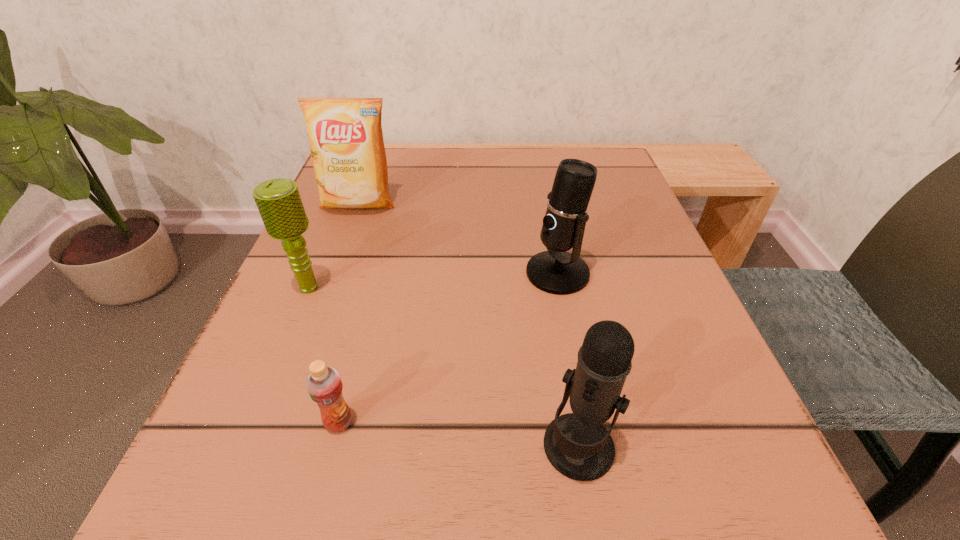
The height and width of the screenshot is (540, 960). I want to click on crisp (potato chip) that is at the left edge, so click(x=345, y=134).

Find the location of a particular element. microphone that is positioned at the left edge is located at coordinates (279, 202).

I want to click on orange juice positioned at the left edge, so click(324, 385).

Find the location of a particular element. The image size is (960, 540). object present at the far left corner is located at coordinates (345, 134).

This screenshot has width=960, height=540. In order to click on object at the near right corner in this screenshot , I will do `click(577, 445)`.

You are a GUI agent. You are given a task and a screenshot of the screen. Output one action in this format:
    pyautogui.click(x=<x>, y=<y>)
    Task: Click on the blank space at the far edge of the desktop
    
    Given the screenshot: What is the action you would take?
    tap(500, 196)

Identify the location of vacant space at the left edge of the desktop. This screenshot has height=540, width=960. (352, 221).

Locate an element on the screen. The height and width of the screenshot is (540, 960). free spot at the right edge of the desktop is located at coordinates [x=666, y=309].

Where is `vacant region at the far right corner`? Image resolution: width=960 pixels, height=540 pixels. vacant region at the far right corner is located at coordinates (552, 150).

Image resolution: width=960 pixels, height=540 pixels. I want to click on empty space between the farthest object and the orange juice, so click(x=348, y=313).